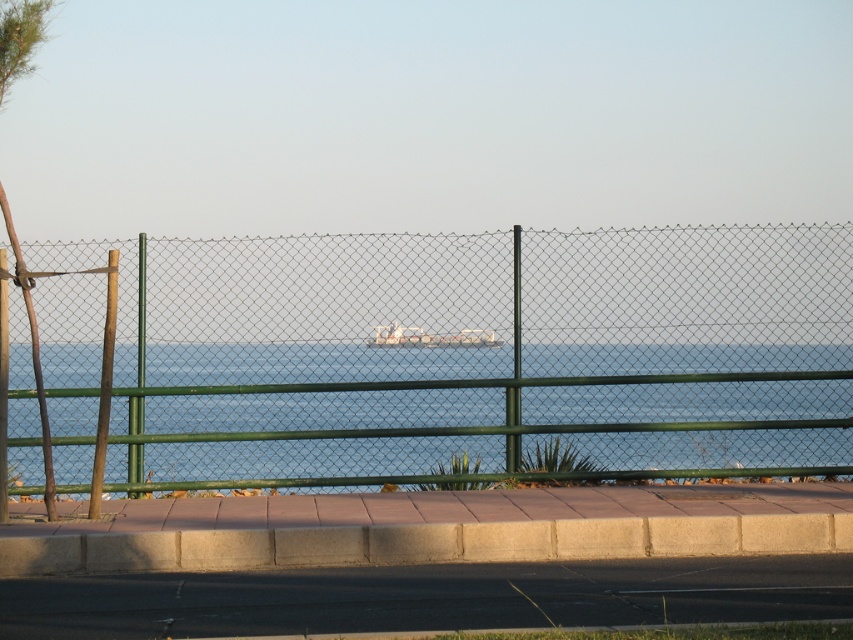
Question: Does green wire fence at left appear on the right side of metallic silver boat at center?

Choices:
 (A) yes
 (B) no

Answer: (B)

Question: Which of these objects is positioned farthest from the metallic chain-link fence at center?

Choices:
 (A) metallic silver boat at center
 (B) green metallic pole at center

Answer: (B)

Question: Which of these objects is positioned farthest from the gray concrete pavement at lower center?

Choices:
 (A) green chain-link fence at center
 (B) green metallic pole at center

Answer: (B)

Question: Can you confirm if smooth concrete curb at lower center is positioned to the right of brown wooden pole at left?

Choices:
 (A) yes
 (B) no

Answer: (A)

Question: Observing the image, what is the correct spatial positioning of green chain-link fence at center in reference to metallic silver boat at center?

Choices:
 (A) above
 (B) below

Answer: (B)

Question: Estimate the real-world distances between objects in this image. Which object is closer to the gray concrete pavement at lower center?

Choices:
 (A) smooth concrete curb at lower center
 (B) green chain-link fence at center
 (C) metallic chain-link fence at center
 (D) brown wooden pole at left

Answer: (A)